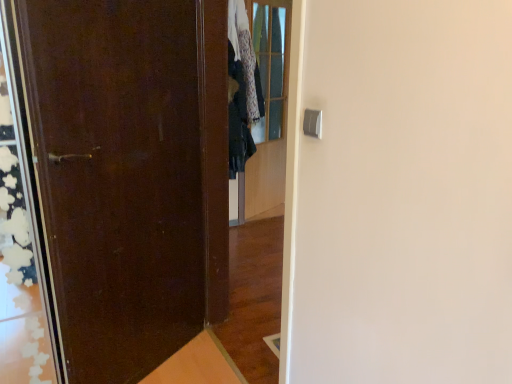
Question: Is point (267, 28) closer or farther from the camera than point (148, 76)?

Choices:
 (A) closer
 (B) farther

Answer: (B)

Question: Considering the positions of clear glass door at upper center and matte dark brown door at left in the image, is clear glass door at upper center taller or shorter than matte dark brown door at left?

Choices:
 (A) short
 (B) tall

Answer: (B)

Question: Estimate the real-world distances between objects in this image. Which object is closer to the dark green fabric at center?

Choices:
 (A) clear glass door at upper center
 (B) matte dark brown door at left

Answer: (A)

Question: Which of these objects is positioned farthest from the dark green fabric at center?

Choices:
 (A) clear glass door at upper center
 (B) matte dark brown door at left

Answer: (B)